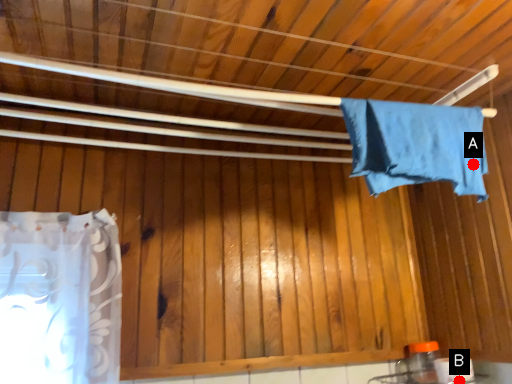
Question: Two points are circled on the image, labeled by A and B beside each circle. Which point is closer to the camera?

Choices:
 (A) A is closer
 (B) B is closer

Answer: (A)